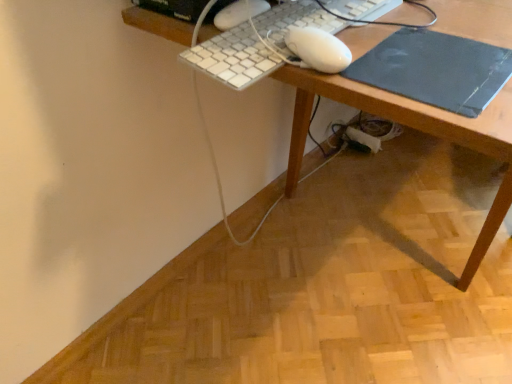
Locate an element on the screen. The width and height of the screenshot is (512, 384). free space underneath black matte mousepad at right (from a real-world perspective) is located at coordinates (435, 64).